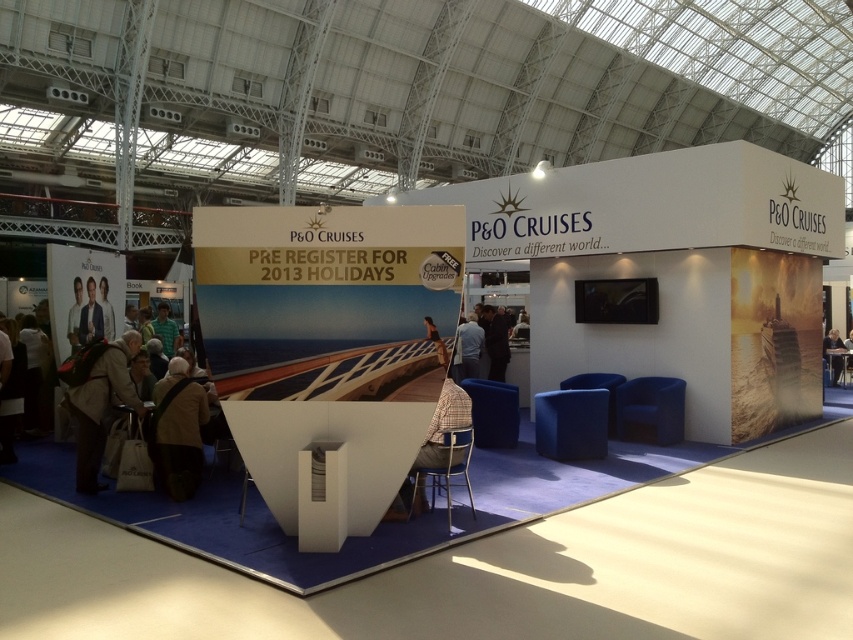
You are a visitor at the cruise fair and want to pick up both the brown leather jacket at lower left and the brown fabric bag at lower left. If your arms can reach 24 inches, can you grab both items at the same time without moving your arms?

The brown leather jacket at lower left is 24.48 inches from the brown fabric bag at lower left. Since your arms can only reach 24 inches, you cannot grab both items at the same time without moving your arms.

You are at the P amp O Cruises booth and need to pick up the brown fabric bag at lower left and the light brown leather chair at lower right. Which object is nearer to you?

The brown fabric bag at lower left is closer to the viewer than the light brown leather chair at lower right.